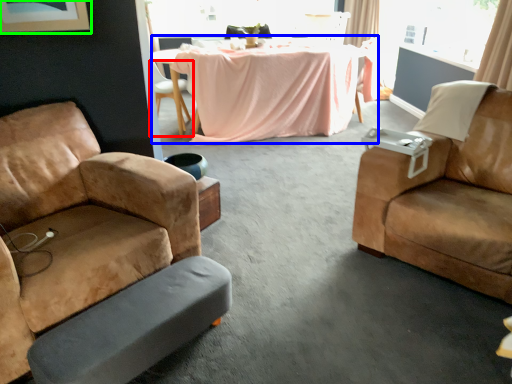
Question: Considering the real-world distances, which object is closest to chair (highlighted by a red box)? table (highlighted by a blue box) or picture frame (highlighted by a green box).

Choices:
 (A) table
 (B) picture frame

Answer: (A)